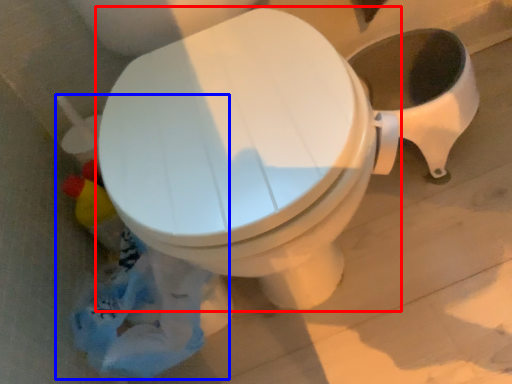
Question: Which object is closer to the camera taking this photo, toilet (highlighted by a red box) or garbage (highlighted by a blue box)?

Choices:
 (A) toilet
 (B) garbage

Answer: (B)